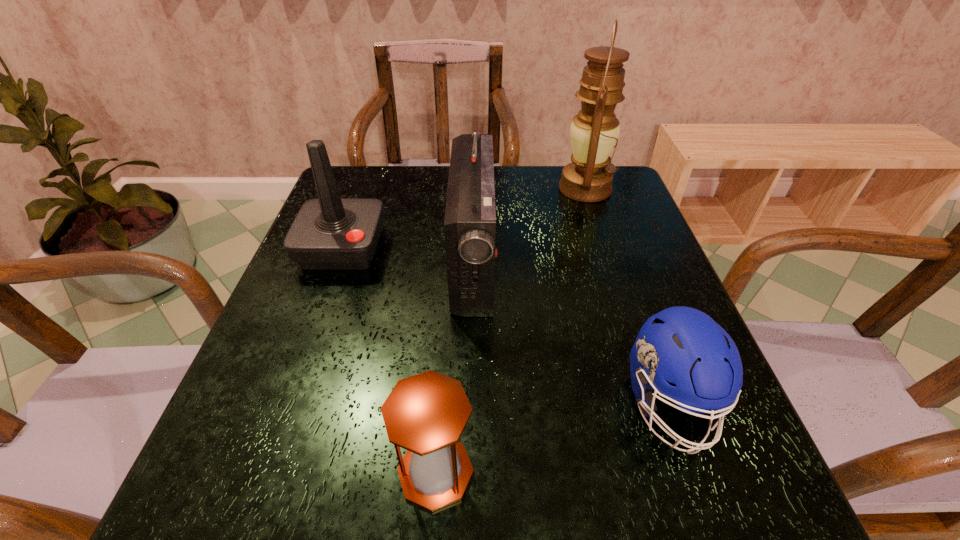
Where is `vacant region at the near edge of the desktop`? The width and height of the screenshot is (960, 540). vacant region at the near edge of the desktop is located at coordinates (572, 505).

In order to click on blank space at the right edge in this screenshot , I will do `click(633, 296)`.

This screenshot has width=960, height=540. I want to click on free point at the far left corner, so [339, 172].

In the image, there is a desktop. Identify the location of vacant area at the near left corner. The height and width of the screenshot is (540, 960). (182, 500).

The width and height of the screenshot is (960, 540). What are the coordinates of `vacant region between the tallest object and the hourglass` in the screenshot? It's located at (511, 330).

Where is `vacant space in between the hourglass and the tallest object`? vacant space in between the hourglass and the tallest object is located at coordinates (511, 330).

Image resolution: width=960 pixels, height=540 pixels. Find the location of `free space between the football helmet and the third tallest object`. free space between the football helmet and the third tallest object is located at coordinates (506, 326).

Where is `vacant area that lies between the farthest object and the football helmet`? The width and height of the screenshot is (960, 540). vacant area that lies between the farthest object and the football helmet is located at coordinates (628, 296).

You are a GUI agent. You are given a task and a screenshot of the screen. Output one action in this format:
    pyautogui.click(x=<x>, y=<y>)
    Task: Click on the unoccupied area between the hourglass and the farthest object
    The height and width of the screenshot is (540, 960).
    Given the screenshot: What is the action you would take?
    pyautogui.click(x=511, y=330)

Locate an element on the screen. The image size is (960, 540). vacant region between the hourglass and the radio receiver is located at coordinates (454, 367).